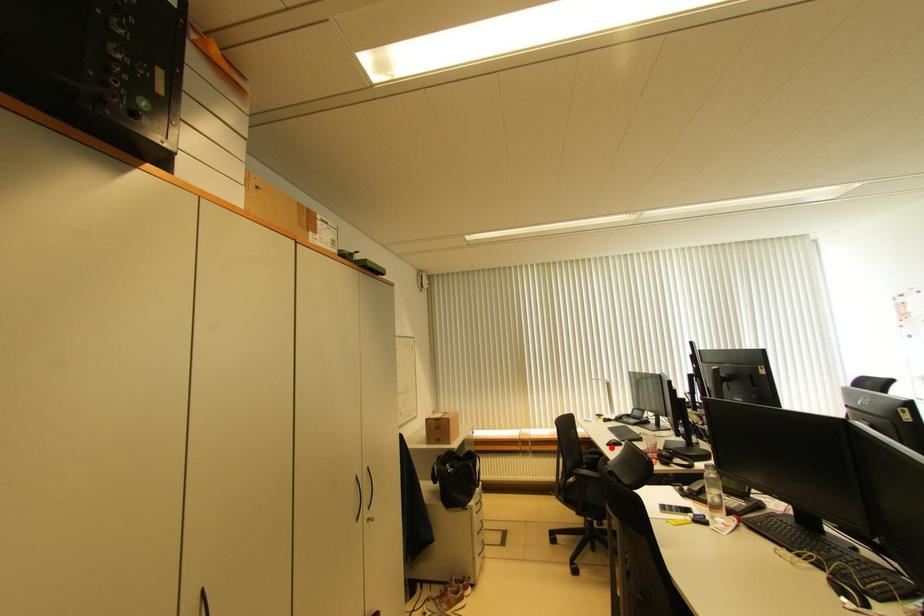
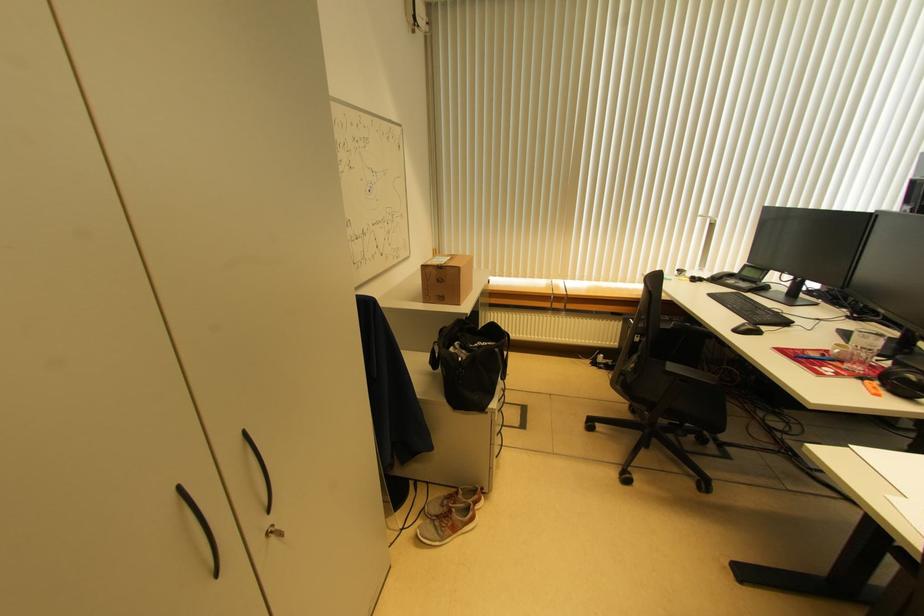
Where in the second image is the point corresponding to the highlighted location from the first image?

(738, 334)